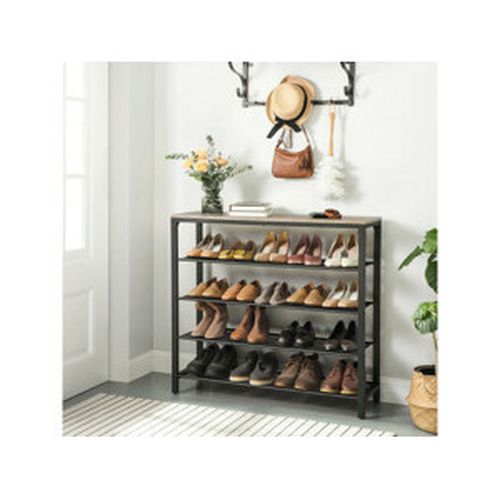
You are a GUI agent. You are given a task and a screenshot of the screen. Output one action in this format:
    pyautogui.click(x=<x>, y=<y>)
    Task: Click on the shoes on shelf above bottom shelf
    
    Given the screenshot: What is the action you would take?
    pyautogui.click(x=301, y=339), pyautogui.click(x=329, y=344), pyautogui.click(x=287, y=339), pyautogui.click(x=344, y=347)